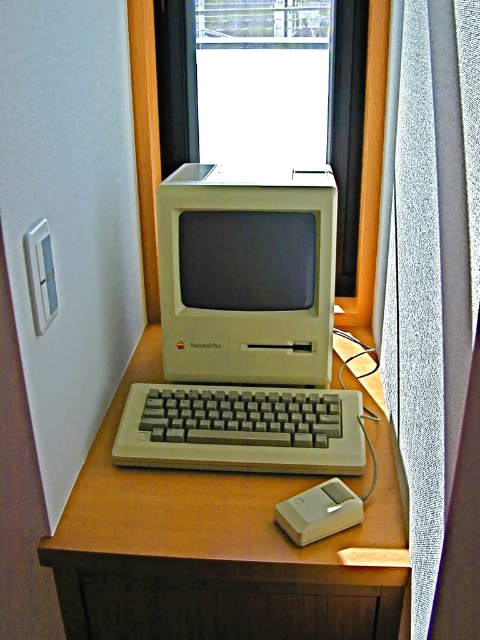
Question: Which object is the closest to the white plastic mouse at center?

Choices:
 (A) wooden at center
 (B) transparent glass window at center
 (C) gray plastic keyboard at center

Answer: (C)

Question: Does transparent glass window at center appear on the right side of gray plastic keyboard at center?

Choices:
 (A) yes
 (B) no

Answer: (A)

Question: Can you confirm if wooden at center is positioned above white plastic computer monitor at center?

Choices:
 (A) yes
 (B) no

Answer: (B)

Question: Which point is farther from the camera taking this photo?

Choices:
 (A) (229, 198)
 (B) (188, 77)
 (C) (211, 528)

Answer: (B)

Question: Which object is positioned closest to the gray plastic keyboard at center?

Choices:
 (A) transparent glass window at center
 (B) white plastic mouse at center

Answer: (B)

Question: Where is transparent glass window at center located in relation to gray plastic keyboard at center in the image?

Choices:
 (A) below
 (B) above

Answer: (B)